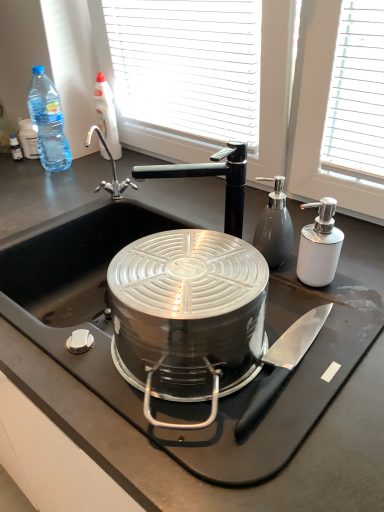
Locate an element on the screen. The width and height of the screenshot is (384, 512). vacant position to the left of blue plastic bottle at upper left, acting as the third bottle starting from the right is located at coordinates (20, 172).